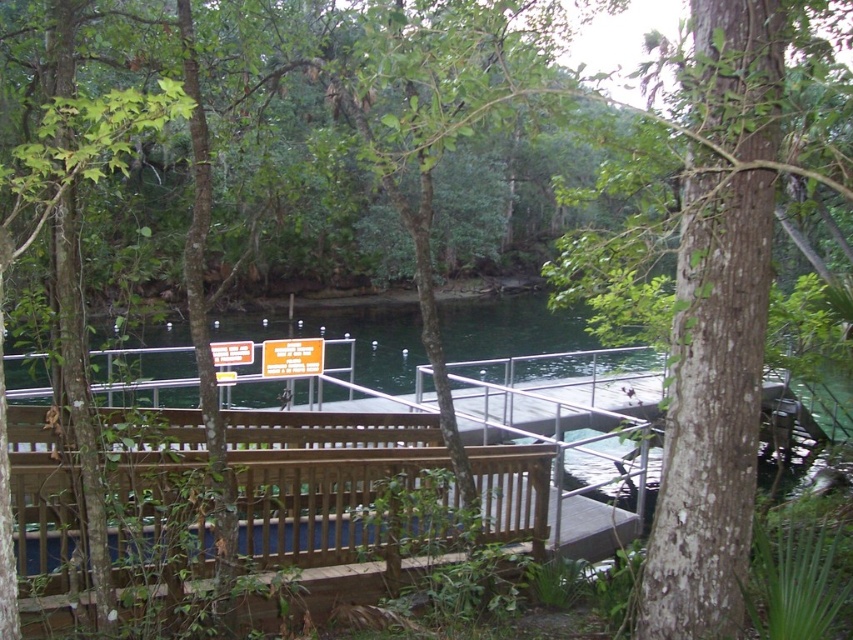
You are a visitor at the park and see both the yellow plastic sign at center and the orange plastic sign at center. Which sign is taller?

The yellow plastic sign at center is taller than the orange plastic sign at center.

You are a maintenance worker who needs to replace both the yellow plastic sign at center and the orange plastic sign at center. If your ladder is 2.5 meters long, can you use it to reach both signs without moving the ladder?

The distance between the yellow plastic sign at center and the orange plastic sign at center is 2.49 meters, which is slightly less than the ladder length of 2.5 meters. Therefore, the ladder can span between them, allowing you to reach both signs without moving it.

You are a hiker approaching the wooden walkway and see two signs ahead. The yellow plastic sign at center and the orange plastic sign at center. Which one is positioned higher in the scene?

The yellow plastic sign at center is located above the orange plastic sign at center, so it is positioned higher.